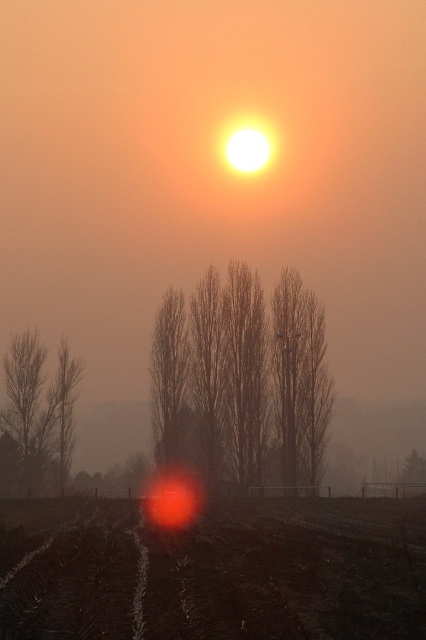
You are standing at the center of the field looking towards the horizon. Which direction should you walk to reach the silhouette bare tree at left?

The silhouette bare tree at left is located at point (40, 410), which is to the left side of the scene. Therefore, you should walk towards the left to reach it.

You are standing in the rural landscape depicted in the image and want to take a photo of the sunset. The silhouetted bare trees at center are blocking your view. Can you move to the left or right to avoid them while staying within the field of view?

The silhouetted bare trees at center are located at point (x=241, y=380), so moving to the left or right within the field of view would allow you to avoid them and capture the sunset.

You are standing in the rural landscape depicted in the sunset scene. You want to walk directly to the silhouetted bare trees at center. Given that the distance between you and the trees is 171.32 feet, how many average human steps would you need to take to reach them?

The distance between you and the silhouetted bare trees at center is 171.32 feet. An average human step is about 2.5 feet long, so dividing 171.32 by 2.5 gives approximately 68.5 steps. Therefore, you would need to take around 69 steps to reach the silhouetted bare trees at center.